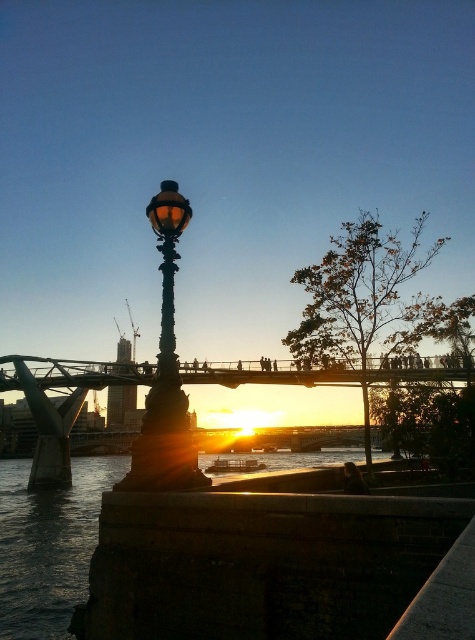
You are a photographer wanting to capture the sunset through the gap between the metallic bridge at center and the matte black street light at center. Can you position yourself so that the street light is above the bridge in the photo?

Yes, because the metallic bridge at center is located below the matte black street light at center, positioning yourself so the street light is above the bridge in the photo is possible.

You are a delivery person needing to pass through the area between the metallic bridge at center and the matte black street light at center. Given that your delivery cart is 2 meters wide, can you fit through the space between them?

The metallic bridge at center is wider than the matte black street light at center. However, the exact width difference isn not provided, so it is uncertain if the 2 meter wide delivery cart can fit through the space between them.

You are an architect designing a new lighting system for the area. You need to ensure that the matte black street light at center doesn not block the view of the metallic bridge at center. Given their sizes, which object should be placed closer to the observer to maintain the bridge as the focal point?

The metallic bridge at center is larger in size than the matte black street light at center. To keep the bridge as the focal point, the smaller matte black street light at center should be placed closer to the observer so it doesn not overpower the larger bridge in the background.